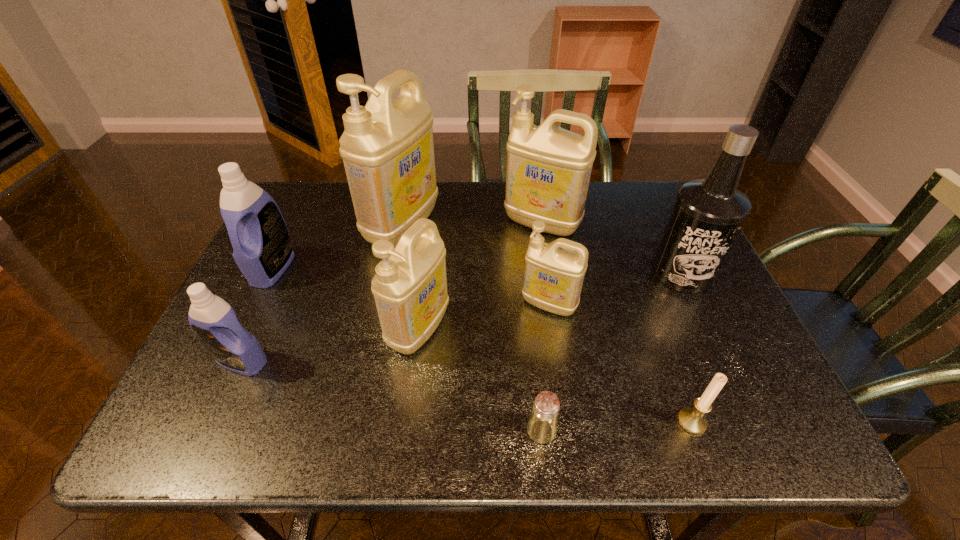
Image resolution: width=960 pixels, height=540 pixels. I want to click on free space between the saltshaker and the biggest beige detergent, so click(x=472, y=328).

I want to click on free space between the candle holder and the nearer blue detergent, so [467, 392].

Where is `empty space between the second smallest beige detergent and the second tallest detergent`? empty space between the second smallest beige detergent and the second tallest detergent is located at coordinates (480, 276).

You are a GUI agent. You are given a task and a screenshot of the screen. Output one action in this format:
    pyautogui.click(x=<x>, y=<y>)
    Task: Click on the vacant space in between the nearer blue detergent and the bigger blue detergent
    This screenshot has width=960, height=540.
    Given the screenshot: What is the action you would take?
    pyautogui.click(x=257, y=315)

The height and width of the screenshot is (540, 960). What are the coordinates of `vacant space that is in between the second biggest beige detergent and the third biggest beige detergent` in the screenshot? It's located at (480, 276).

Image resolution: width=960 pixels, height=540 pixels. I want to click on vacant space that is in between the saltshaker and the black liquor, so click(x=612, y=352).

Identify the location of vacant area that lies between the second tallest detergent and the rightmost object. (612, 248).

What are the coordinates of `free area in between the bigger blue detergent and the tallest detergent` in the screenshot? It's located at 338,247.

Select which object appears as the fourth closest to the candle holder. Please provide its 2D coordinates. Your answer should be formatted as a tuple, i.e. [(x, y)], where the tuple contains the x and y coordinates of a point satisfying the conditions above.

[(410, 287)]

Find the location of a particular element. object that can be found as the eighth closest to the saltshaker is located at coordinates (262, 249).